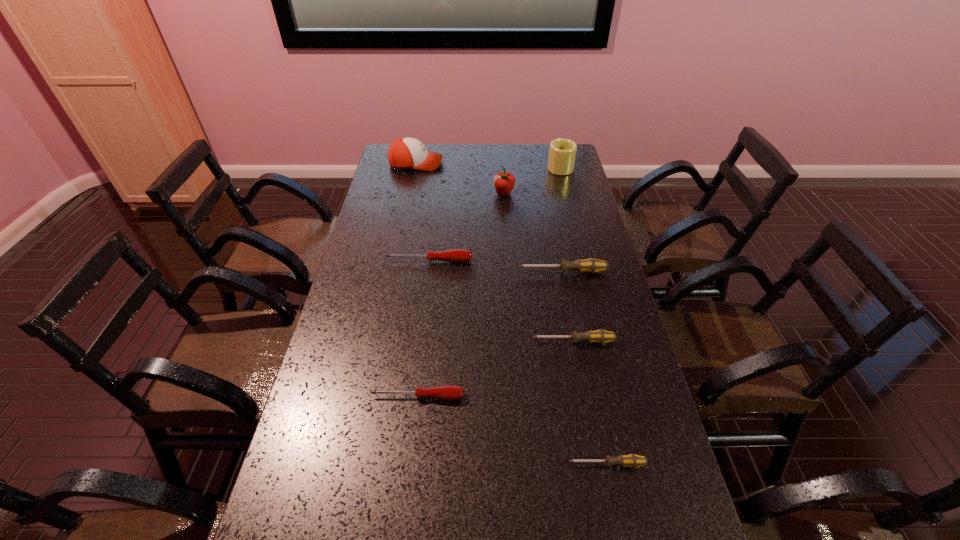
What are the coordinates of `orange baseball cap` in the screenshot? It's located at (405, 153).

Locate an element on the screen. Image resolution: width=960 pixels, height=540 pixels. beige mug is located at coordinates (562, 152).

Where is `the third farthest object`? This screenshot has width=960, height=540. the third farthest object is located at coordinates (504, 182).

I want to click on apple, so click(504, 182).

At what (x,y) coordinates should I click in order to perform the action: click on the fourth nearest screwdriver. Please return your answer as a coordinate pair (x, y). Looking at the image, I should click on tap(591, 265).

Locate an element on the screen. Image resolution: width=960 pixels, height=540 pixels. the biggest gray screwdriver is located at coordinates (591, 265).

This screenshot has height=540, width=960. In order to click on the bigger red screwdriver in this screenshot , I will do `click(457, 255)`.

At what (x,y) coordinates should I click in order to perform the action: click on the fifth nearest object. Please return your answer as a coordinate pair (x, y). The image size is (960, 540). Looking at the image, I should click on (457, 255).

Locate an element on the screen. This screenshot has width=960, height=540. the third nearest screwdriver is located at coordinates (600, 336).

Identify the location of the sixth farthest object. [x=600, y=336].